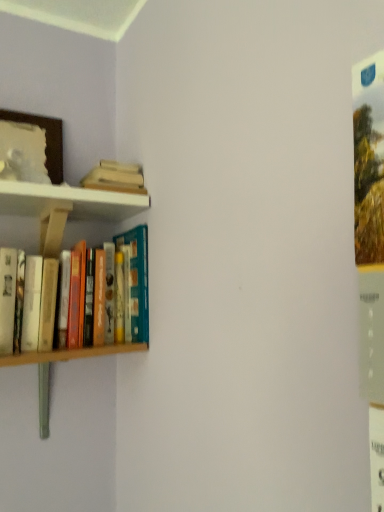
This screenshot has height=512, width=384. Describe the element at coordinates (46, 140) in the screenshot. I see `wooden picture frame at upper left` at that location.

Find the location of `wooden picture frame at upper left`. wooden picture frame at upper left is located at coordinates point(46,140).

From a real-world perspective, relative to hardcover books at left, which appears as the 2th book when viewed from the top, is wooden picture frame at upper left vertically above or below?

wooden picture frame at upper left is above hardcover books at left, which appears as the 2th book when viewed from the top.

From the image's perspective, which one is positioned higher, wooden picture frame at upper left or hardcover books at left, which appears as the 2th book when viewed from the top?

From the image's view, wooden picture frame at upper left is above.

Is wooden picture frame at upper left far from hardcover books at left, which appears as the 2th book when viewed from the top?

wooden picture frame at upper left is actually quite close to hardcover books at left, which appears as the 2th book when viewed from the top.

Which object is further away from the camera taking this photo, wooden picture frame at upper left or hardcover books at left, which appears as the 2th book when viewed from the top?

wooden picture frame at upper left is further away from the camera.

Is point (62, 352) positioned behind point (21, 114)?

That is False.

Relative to wooden picture frame at upper left, is hardcover books at left, the first book when ordered from bottom to top, in front or behind?

hardcover books at left, the first book when ordered from bottom to top, is positioned closer to the viewer than wooden picture frame at upper left.

From the image's perspective, which one is positioned higher, hardcover books at left, which appears as the 2th book when viewed from the top, or wooden picture frame at upper left?

wooden picture frame at upper left appears higher in the image.

Is hardcover books at left, the first book when ordered from bottom to top, inside the boundaries of hardcover book at upper left, the first book viewed from the top, or outside?

hardcover books at left, the first book when ordered from bottom to top, is spatially situated outside hardcover book at upper left, the first book viewed from the top.

From the image's perspective, is hardcover books at left, the first book when ordered from bottom to top, located above or below hardcover book at upper left, arranged as the 2th book when ordered from the bottom?

From the image's perspective, hardcover books at left, the first book when ordered from bottom to top, appears below hardcover book at upper left, arranged as the 2th book when ordered from the bottom.

Locate an element on the screen. book lying on the left of hardcover book at upper left, arranged as the 2th book when ordered from the bottom is located at coordinates (73, 353).

Consider the image. Does hardcover books at left, which appears as the 2th book when viewed from the top, appear on the left side of hardcover book at upper left, the first book viewed from the top?

Correct, you'll find hardcover books at left, which appears as the 2th book when viewed from the top, to the left of hardcover book at upper left, the first book viewed from the top.

Considering the positions of objects wooden picture frame at upper left and hardcover book at upper left, arranged as the 2th book when ordered from the bottom, in the image provided, who is behind, wooden picture frame at upper left or hardcover book at upper left, arranged as the 2th book when ordered from the bottom,?

Result: hardcover book at upper left, arranged as the 2th book when ordered from the bottom.

Which object is wider, wooden picture frame at upper left or hardcover book at upper left, the first book viewed from the top?

hardcover book at upper left, the first book viewed from the top, is wider.

Measure the distance between wooden picture frame at upper left and hardcover book at upper left, arranged as the 2th book when ordered from the bottom.

The distance of wooden picture frame at upper left from hardcover book at upper left, arranged as the 2th book when ordered from the bottom, is 6.78 inches.

Can you confirm if hardcover book at upper left, arranged as the 2th book when ordered from the bottom, is taller than hardcover books at left, which appears as the 2th book when viewed from the top?

No, hardcover book at upper left, arranged as the 2th book when ordered from the bottom, is not taller than hardcover books at left, which appears as the 2th book when viewed from the top.

Between hardcover book at upper left, arranged as the 2th book when ordered from the bottom, and hardcover books at left, the first book when ordered from bottom to top, which one is positioned in front?

hardcover books at left, the first book when ordered from bottom to top, is in front.

What's the angular difference between hardcover book at upper left, the first book viewed from the top, and hardcover books at left, the first book when ordered from bottom to top,'s facing directions?

hardcover book at upper left, the first book viewed from the top, and hardcover books at left, the first book when ordered from bottom to top, are facing 0.000161 degrees away from each other.

Can you confirm if hardcover book at upper left, the first book viewed from the top, is smaller than hardcover books at left, the first book when ordered from bottom to top?

Indeed, hardcover book at upper left, the first book viewed from the top, has a smaller size compared to hardcover books at left, the first book when ordered from bottom to top.

Consider the image. Are hardcover book at upper left, the first book viewed from the top, and wooden picture frame at upper left far apart?

No, hardcover book at upper left, the first book viewed from the top, is not far from wooden picture frame at upper left.

Is hardcover book at upper left, the first book viewed from the top, facing away from wooden picture frame at upper left?

No, hardcover book at upper left, the first book viewed from the top, is not facing away from wooden picture frame at upper left.

Between point (115, 166) and point (55, 173), which one is positioned in front?

The point (115, 166) is closer.

This screenshot has width=384, height=512. Find the location of `picture frame to the left of hardcover books at left, which appears as the 2th book when viewed from the top`. picture frame to the left of hardcover books at left, which appears as the 2th book when viewed from the top is located at coordinates (46, 140).

Where is `book that is the 2nd one below the wooden picture frame at upper left (from a real-world perspective)`? The width and height of the screenshot is (384, 512). book that is the 2nd one below the wooden picture frame at upper left (from a real-world perspective) is located at coordinates (73, 353).

When comparing their distances from hardcover books at left, which appears as the 2th book when viewed from the top, does hardcover book at upper left, the first book viewed from the top, or wooden picture frame at upper left seem closer?

The object closer to hardcover books at left, which appears as the 2th book when viewed from the top, is hardcover book at upper left, the first book viewed from the top.

Based on their spatial positions, is wooden picture frame at upper left or hardcover books at left, which appears as the 2th book when viewed from the top, further from hardcover book at upper left, arranged as the 2th book when ordered from the bottom?

hardcover books at left, which appears as the 2th book when viewed from the top, lies further to hardcover book at upper left, arranged as the 2th book when ordered from the bottom, than the other object.

Consider the image. From the image, which object appears to be nearer to wooden picture frame at upper left, hardcover books at left, the first book when ordered from bottom to top, or hardcover book at upper left, the first book viewed from the top?

hardcover book at upper left, the first book viewed from the top.

Looking at the image, which one is located further to wooden picture frame at upper left, hardcover book at upper left, the first book viewed from the top, or hardcover books at left, the first book when ordered from bottom to top?

hardcover books at left, the first book when ordered from bottom to top, lies further to wooden picture frame at upper left than the other object.

Based on their spatial positions, is wooden picture frame at upper left or hardcover book at upper left, arranged as the 2th book when ordered from the bottom, closer to hardcover books at left, which appears as the 2th book when viewed from the top?

Based on the image, hardcover book at upper left, arranged as the 2th book when ordered from the bottom, appears to be nearer to hardcover books at left, which appears as the 2th book when viewed from the top.

When comparing their distances from hardcover book at upper left, the first book viewed from the top, does hardcover books at left, which appears as the 2th book when viewed from the top, or wooden picture frame at upper left seem closer?

wooden picture frame at upper left lies closer to hardcover book at upper left, the first book viewed from the top, than the other object.

You are a GUI agent. You are given a task and a screenshot of the screen. Output one action in this format:
    pyautogui.click(x=<x>, y=<y>)
    Task: Click on the book between wooden picture frame at upper left and hardcover books at left, the first book when ordered from bottom to top, in the up-down direction
    This screenshot has height=512, width=384.
    Given the screenshot: What is the action you would take?
    pyautogui.click(x=115, y=177)